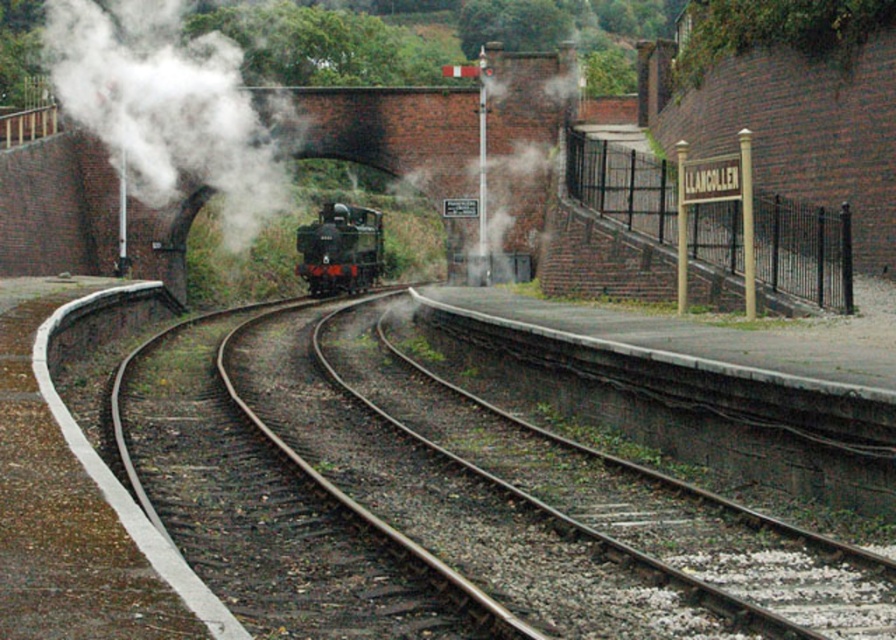
In the scene shown: How far apart are smooth steel tracks at center and gold metal sign at upper right?

smooth steel tracks at center and gold metal sign at upper right are 22.97 feet apart from each other.

Is point (725, 561) farther from viewer compared to point (849, 314)?

No.

This screenshot has width=896, height=640. Find the location of `smooth steel tracks at center`. smooth steel tracks at center is located at coordinates (474, 502).

Who is more distant from viewer, (191, 60) or (373, 227)?

The point (191, 60) is more distant.

Does point (122, 42) come farther from viewer compared to point (380, 221)?

Yes, point (122, 42) is behind point (380, 221).

The width and height of the screenshot is (896, 640). What do you see at coordinates (171, 108) in the screenshot?
I see `white vapor at center` at bounding box center [171, 108].

Find the location of a particular element. white vapor at center is located at coordinates (171, 108).

Which is above, white vapor at center or gold metal sign at upper right?

white vapor at center is higher up.

Does white vapor at center have a lesser height compared to gold metal sign at upper right?

No.

The height and width of the screenshot is (640, 896). What do you see at coordinates (171, 108) in the screenshot? I see `white vapor at center` at bounding box center [171, 108].

Where is `white vapor at center`? The width and height of the screenshot is (896, 640). white vapor at center is located at coordinates (171, 108).